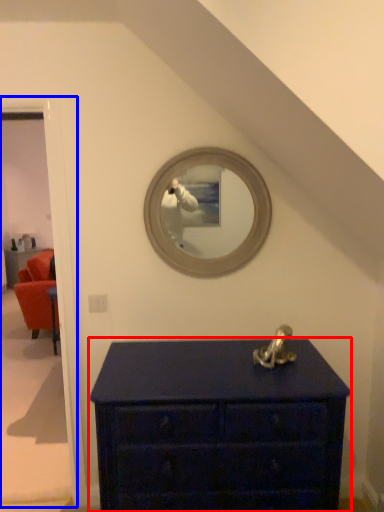
Question: Among these objects, which one is nearest to the camera, chest of drawers (highlighted by a red box) or door (highlighted by a blue box)?

Choices:
 (A) chest of drawers
 (B) door

Answer: (A)